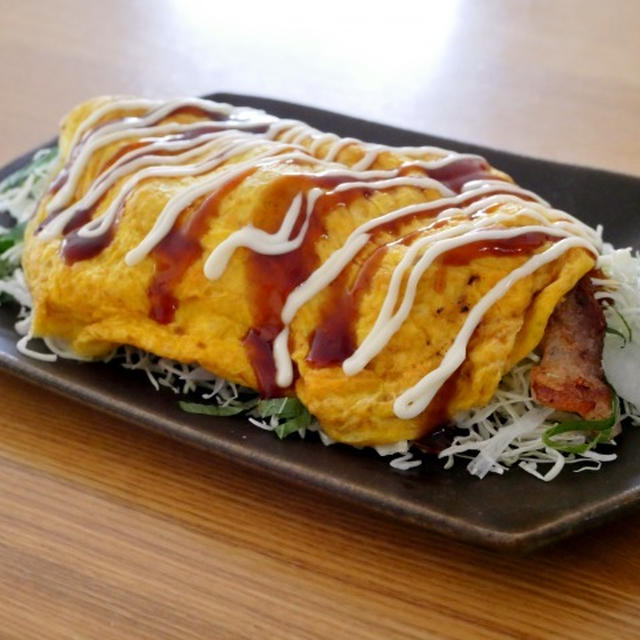
The image size is (640, 640). What are the coordinates of `table` in the screenshot? It's located at (228, 530).